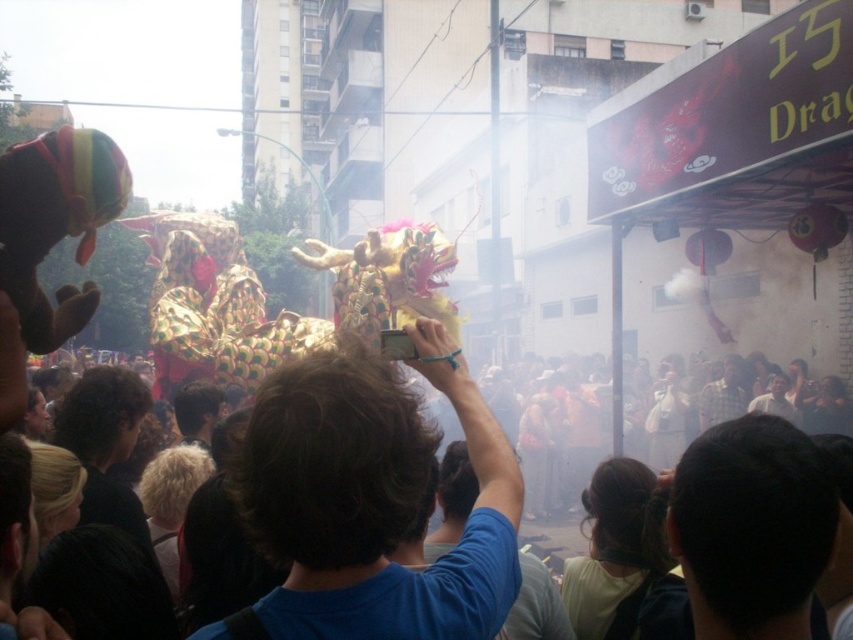
Consider the image. Does dark brown hair at center have a lesser height compared to blonde hair at center?

No, dark brown hair at center is not shorter than blonde hair at center.

Who is positioned more to the right, dark brown hair at center or blonde hair at center?

blonde hair at center is more to the right.

What do you see at coordinates (105, 444) in the screenshot? The height and width of the screenshot is (640, 853). I see `dark brown hair at center` at bounding box center [105, 444].

Identify the location of dark brown hair at center. (105, 444).

What do you see at coordinates (373, 499) in the screenshot? The height and width of the screenshot is (640, 853). I see `blue fabric shirt at center` at bounding box center [373, 499].

Is blue fabric shirt at center thinner than dark brown hair at center?

No, blue fabric shirt at center is not thinner than dark brown hair at center.

Between point (407, 605) and point (93, 406), which one is positioned in front?

Point (407, 605)

Where is `blue fabric shirt at center`? Image resolution: width=853 pixels, height=640 pixels. blue fabric shirt at center is located at coordinates (373, 499).

What do you see at coordinates (373, 499) in the screenshot? Image resolution: width=853 pixels, height=640 pixels. I see `blue fabric shirt at center` at bounding box center [373, 499].

Is blue fabric shirt at center below plaid fabric shirt at center?

Incorrect, blue fabric shirt at center is not positioned below plaid fabric shirt at center.

In order to click on blue fabric shirt at center in this screenshot , I will do `click(373, 499)`.